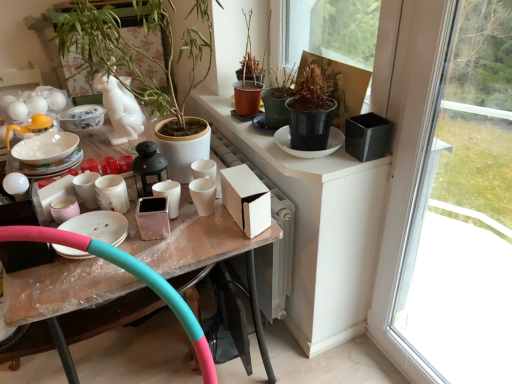
Locate an element on the screen. The height and width of the screenshot is (384, 512). empty space that is to the right of matte pink plate at lower left, the third tableware viewed from the right is located at coordinates (167, 243).